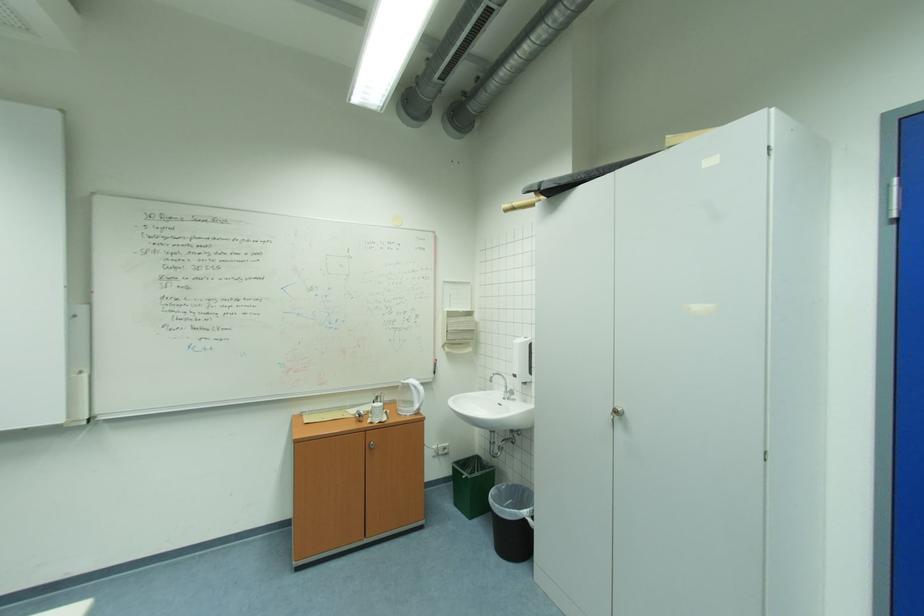
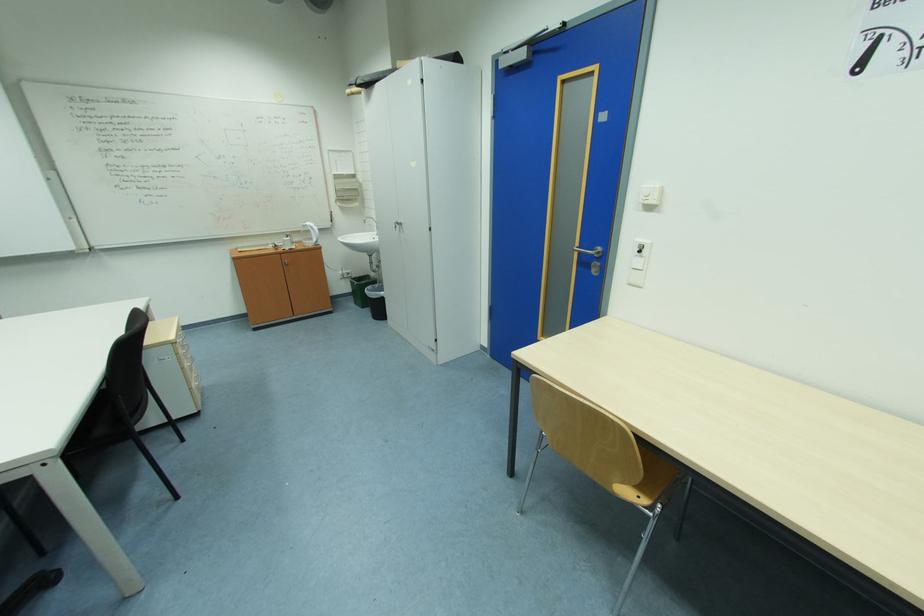
Where in the second image is the point corresponding to point (479, 519) from the first image?

(370, 309)